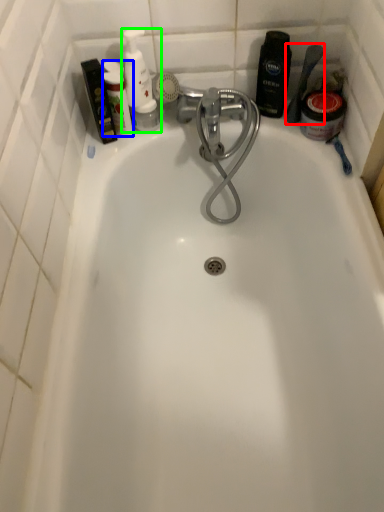
Question: Which is nearer to the shower (highlighted by a red box)? toiletry (highlighted by a blue box) or toiletry (highlighted by a green box).

Choices:
 (A) toiletry
 (B) toiletry

Answer: (B)